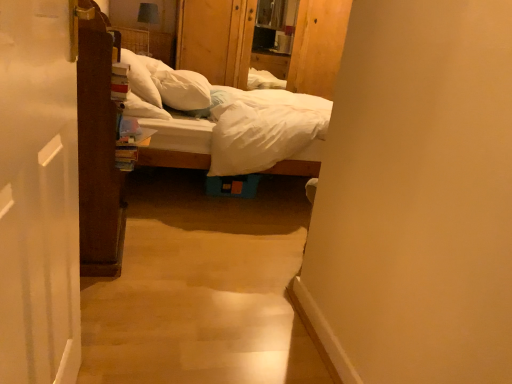
Question: Which direction should I rotate to face white soft pillow at center, which is the first pillow in right-to-left order, — up or down?

Choices:
 (A) down
 (B) up

Answer: (B)

Question: From a real-world perspective, is wooden dresser at center beneath white cotton bed at center?

Choices:
 (A) yes
 (B) no

Answer: (B)

Question: Can you confirm if wooden dresser at center is positioned to the left of white cotton bed at center?

Choices:
 (A) no
 (B) yes

Answer: (A)

Question: Is wooden dresser at center directly adjacent to white cotton bed at center?

Choices:
 (A) yes
 (B) no

Answer: (B)

Question: Does wooden dresser at center appear on the right side of white cotton bed at center?

Choices:
 (A) no
 (B) yes

Answer: (B)

Question: Considering the relative sizes of wooden dresser at center and white cotton bed at center in the image provided, is wooden dresser at center bigger than white cotton bed at center?

Choices:
 (A) yes
 (B) no

Answer: (B)

Question: Is white cotton bed at center at the back of wooden dresser at center?

Choices:
 (A) no
 (B) yes

Answer: (A)

Question: Is wooden dresser at center shorter than white soft pillow at upper center, marked as the 2th pillow in a right-to-left arrangement?

Choices:
 (A) no
 (B) yes

Answer: (A)

Question: From the image's perspective, is wooden dresser at center below white soft pillow at upper center, marked as the 2th pillow in a right-to-left arrangement?

Choices:
 (A) no
 (B) yes

Answer: (A)

Question: Is wooden dresser at center bigger than white soft pillow at upper center, marked as the 2th pillow in a right-to-left arrangement?

Choices:
 (A) yes
 (B) no

Answer: (A)

Question: Is wooden dresser at center smaller than white soft pillow at upper center, marked as the 2th pillow in a right-to-left arrangement?

Choices:
 (A) no
 (B) yes

Answer: (A)

Question: From the image's perspective, is wooden dresser at center above white soft pillow at upper center, marked as the 2th pillow in a right-to-left arrangement?

Choices:
 (A) yes
 (B) no

Answer: (A)

Question: Does wooden dresser at center lie in front of white soft pillow at upper center, arranged as the first pillow when viewed from the left?

Choices:
 (A) yes
 (B) no

Answer: (B)

Question: Can you confirm if white soft pillow at upper center, marked as the 2th pillow in a right-to-left arrangement, is taller than wooden dresser at center?

Choices:
 (A) yes
 (B) no

Answer: (B)